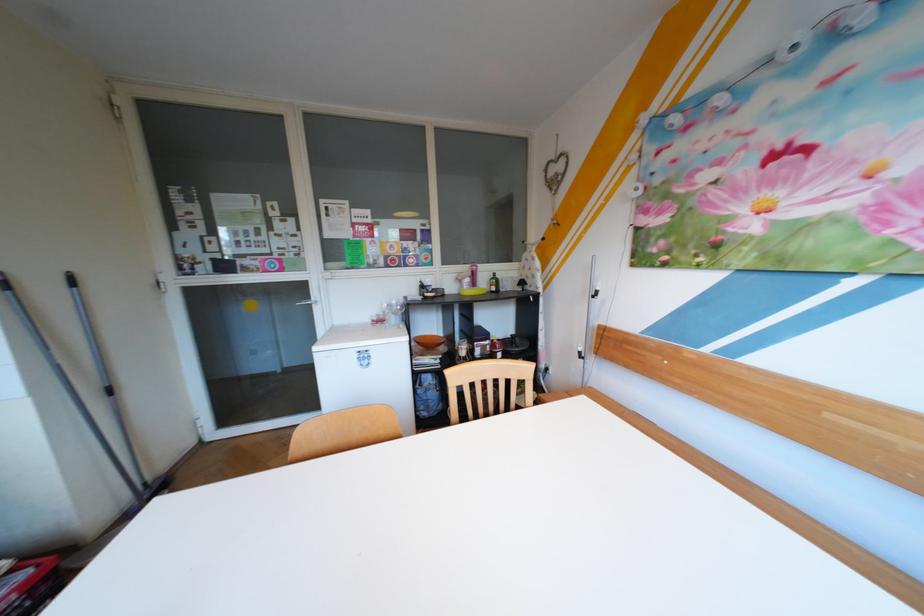
The width and height of the screenshot is (924, 616). Find the location of `white freezer lid`. white freezer lid is located at coordinates (360, 334).